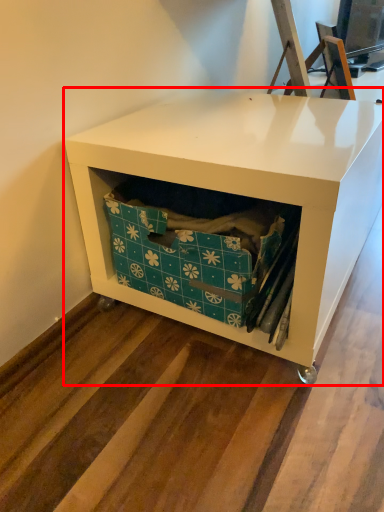
Question: From the image's perspective, where is furniture (annotated by the red box) located relative to storage box?

Choices:
 (A) below
 (B) above

Answer: (B)